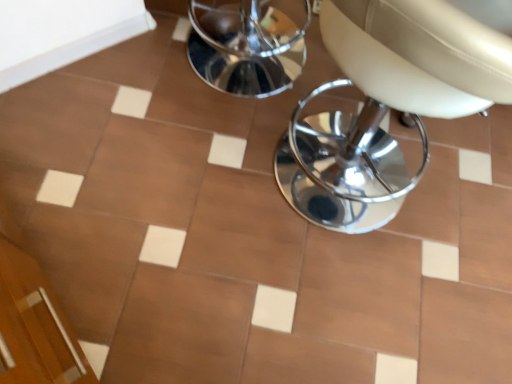
Describe the element at coordinates (386, 104) in the screenshot. Image resolution: width=512 pixels, height=384 pixels. I see `white leather chair at center` at that location.

You are a GUI agent. You are given a task and a screenshot of the screen. Output one action in this format:
    pyautogui.click(x=<x>, y=<y>)
    Task: Click on the white leather chair at center
    The height and width of the screenshot is (384, 512).
    Given the screenshot: What is the action you would take?
    pyautogui.click(x=386, y=104)

You are a GUI agent. You are given a task and a screenshot of the screen. Output one action in this format:
    pyautogui.click(x=<x>, y=<y>)
    Task: Click on the white glossy tile at upper left
    Image resolution: width=512 pixels, height=384 pixels.
    Given the screenshot: What is the action you would take?
    pyautogui.click(x=130, y=58)

This screenshot has height=384, width=512. Describe the element at coordinates (130, 58) in the screenshot. I see `white glossy tile at upper left` at that location.

Where is `white leather chair at center`? The image size is (512, 384). white leather chair at center is located at coordinates (386, 104).

Visually, is white glossy tile at upper left positioned to the left or to the right of white leather chair at center?

white glossy tile at upper left is positioned on white leather chair at center's left side.

Considering the positions of objects white glossy tile at upper left and white leather chair at center in the image provided, who is in front, white glossy tile at upper left or white leather chair at center?

white leather chair at center is in front.

Does point (156, 68) come behind point (419, 85)?

That is True.

From the image's perspective, does white glossy tile at upper left appear higher than white leather chair at center?

Yes, from the image's perspective, white glossy tile at upper left is above white leather chair at center.

From a real-world perspective, who is located higher, white glossy tile at upper left or white leather chair at center?

white leather chair at center.

Is white glossy tile at upper left thinner than white leather chair at center?

Yes, white glossy tile at upper left is thinner than white leather chair at center.

Who is shorter, white glossy tile at upper left or white leather chair at center?

With less height is white glossy tile at upper left.

Considering the relative sizes of white glossy tile at upper left and white leather chair at center in the image provided, is white glossy tile at upper left smaller than white leather chair at center?

Yes.

Does white glossy tile at upper left contain white leather chair at center?

No, white leather chair at center is located outside of white glossy tile at upper left.

Based on the photo, are white glossy tile at upper left and white leather chair at center located far from each other?

No, white glossy tile at upper left is not far from white leather chair at center.

Is white glossy tile at upper left oriented towards white leather chair at center?

No, white glossy tile at upper left is not turned towards white leather chair at center.

Measure the distance between white glossy tile at upper left and white leather chair at center.

white glossy tile at upper left and white leather chair at center are 24.53 inches apart.

What are the coordinates of `ceramic tile that appears behind the white leather chair at center` in the screenshot? It's located at (130, 58).

Considering the positions of objects white leather chair at center and white glossy tile at upper left in the image provided, who is more to the left, white leather chair at center or white glossy tile at upper left?

Positioned to the left is white glossy tile at upper left.

Considering their positions, is white leather chair at center located in front of or behind white glossy tile at upper left?

→ In the image, white leather chair at center appears in front of white glossy tile at upper left.

Does point (337, 201) lie in front of point (150, 70)?

Yes.

From the image's perspective, between white leather chair at center and white glossy tile at upper left, which one is located above?

white glossy tile at upper left.

From a real-world perspective, which object stands above the other?

From a 3D spatial view, white leather chair at center is above.

Is white leather chair at center thinner than white glossy tile at upper left?

No.

Considering the relative sizes of white leather chair at center and white glossy tile at upper left in the image provided, is white leather chair at center shorter than white glossy tile at upper left?

No.

Can you confirm if white leather chair at center is smaller than white glossy tile at upper left?

Actually, white leather chair at center might be larger than white glossy tile at upper left.

Is white leather chair at center inside the boundaries of white glossy tile at upper left, or outside?

white leather chair at center lies outside white glossy tile at upper left.

Does white leather chair at center touch white glossy tile at upper left?

No, white leather chair at center is not with white glossy tile at upper left.

Is white leather chair at center facing away from white glossy tile at upper left?

white leather chair at center is not turned away from white glossy tile at upper left.

How different are the orientations of white leather chair at center and white glossy tile at upper left in degrees?

They differ by 92.5 degrees in their facing directions.

Locate an element on the screen. ceramic tile located on the left of white leather chair at center is located at coordinates (130, 58).

There is a white glossy tile at upper left. Identify the location of chair above it (from a real-world perspective). [386, 104].

I want to click on chair that is below the white glossy tile at upper left (from the image's perspective), so click(386, 104).